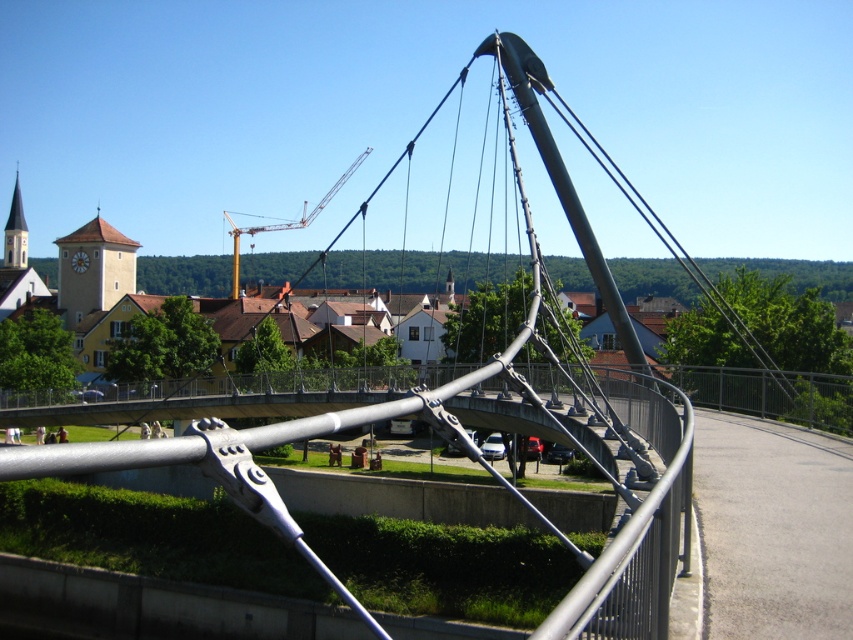
You are a construction inspector standing on the polished steel bridge at center. You need to inspect the yellow metallic crane at upper center. Given that your inspection equipment has a maximum range of 100 meters, will you be able to effectively inspect the crane from your current position?

The distance between the polished steel bridge at center and the yellow metallic crane at upper center is 100.39 meters, which exceeds the equipment range of 100 meters. Therefore, you cannot effectively inspect the crane from your current position.

You are a drone operator tasked with capturing aerial footage of the polished steel bridge at center. The drone must maintain a safe distance of at least 50 meters from the bridge to avoid interference with pedestrians. Given the bridge is at coordinates point 0.820, 0.747, can you determine if the drone is within the required safety zone?

The polished steel bridge at center is located at point (636, 524). To determine if the drone is within the 50 meter safety zone, precise distance calculations based on coordinate systems would be required. However, the provided information does not include the drone or observer position, making it impossible to confirm compliance with the safety distance requirement.

You are a photographer standing on the polished steel bridge at center. You want to capture the yellow metallic crane at upper center in your shot. Is the crane positioned above or below the bridge in the image?

The yellow metallic crane at upper center is positioned above the polished steel bridge at center in the image.